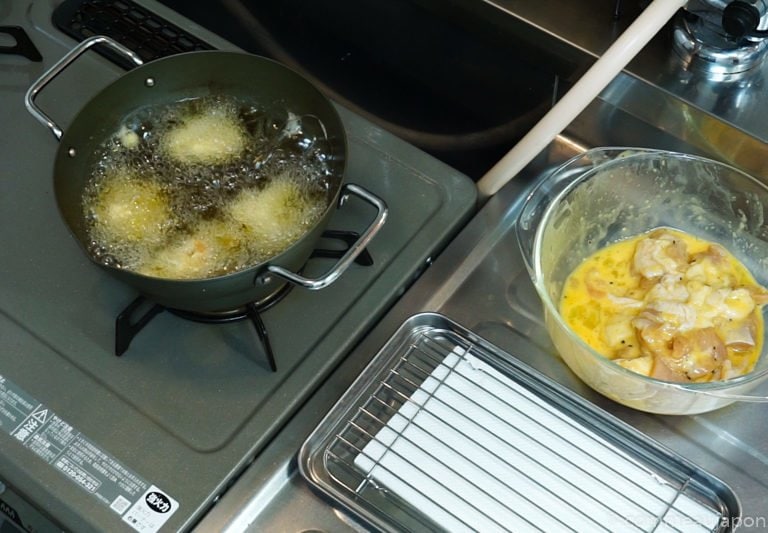
Identify the location of edge of left burner. This screenshot has height=533, width=768. (18, 37).